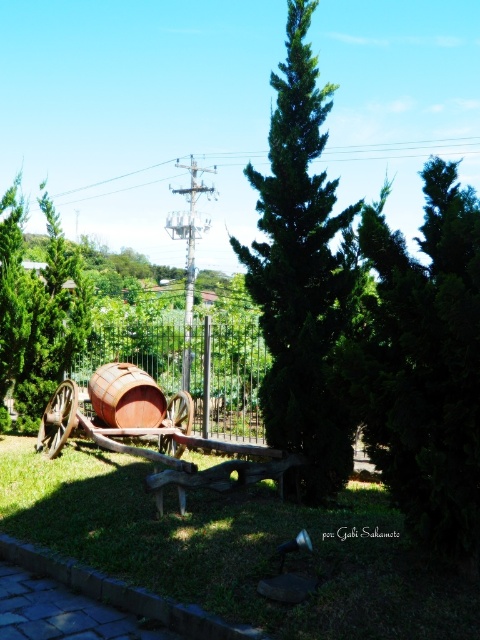
Consider the image. You are standing at the edge of the grassy area and want to walk towards the green leafy tree at center. Which direction should you walk relative to the green grass at center?

You should walk to the right of the green grass at center because the green grass at center is to the left of green leafy tree at center, meaning the tree is to the right of the grass.

You are planning to hang a small birdhouse on the metallic wire at upper center. Considering the position of the rusty metal barrel at center, will the birdhouse be visible from the ground level?

The metallic wire at upper center is located above the rusty metal barrel at center, so the birdhouse hung on the metallic wire at upper center will be visible from the ground level as it is positioned higher than the barrel.